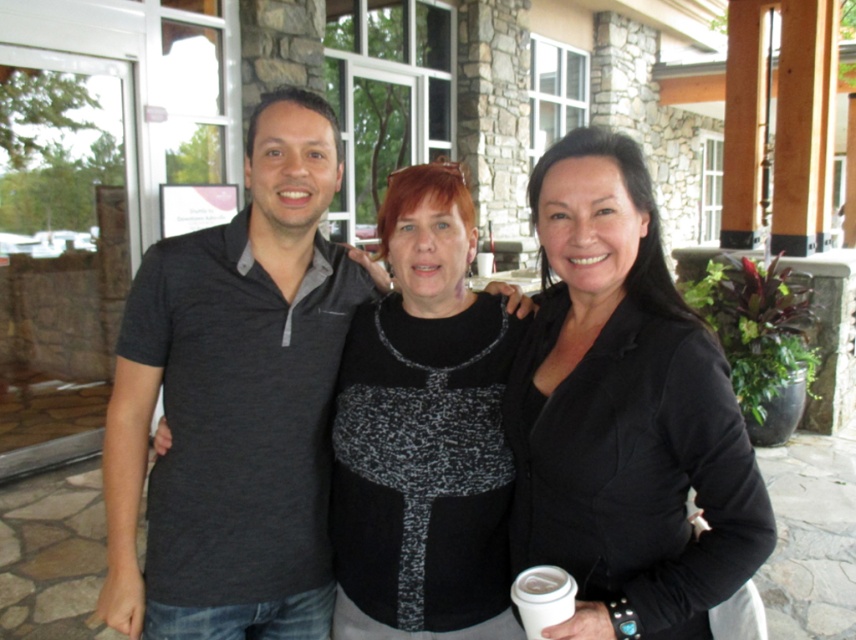
You are standing in the outdoor area and want to reach the point marked as point (556,472). Can you estimate how far you need to walk to get there?

The point (556,472) is 1.37 meters away from the viewer, so you need to walk approximately 1.37 meters to reach it.

You are a photographer trying to capture a group photo of the black matte blazer at center and the white paper cup at lower center. Since you want to ensure both subjects are clearly visible in the frame, which object should you prioritize positioning closer to the camera to avoid being obscured by the other?

The black matte blazer at center is wider than the white paper cup at lower center. Therefore, you should position the black matte blazer at center closer to the camera to ensure its full width is visible without being obscured by the narrower white paper cup at lower center.

You are a delivery robot with a package that needs to be placed between the black matte blazer at center and the white paper cup at lower center. The package is 12 inches long. Will it fit in the space between them?

The distance between the black matte blazer at center and the white paper cup at lower center is 12.24 inches. Since the package is 12 inches long, it will fit in the space between them as there is enough room.